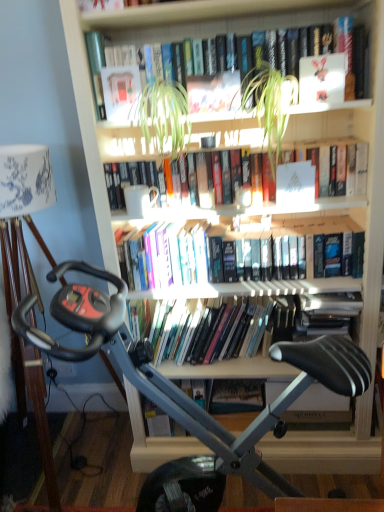
Question: Considering the positions of white matte paper at center, the 3th paperback book positioned from the left, and green leafy plant at center, positioned as the first plant in left-to-right order, in the image, is white matte paper at center, the 3th paperback book positioned from the left, wider or thinner than green leafy plant at center, positioned as the first plant in left-to-right order,?

Choices:
 (A) thin
 (B) wide

Answer: (A)

Question: From their relative heights in the image, would you say white matte paper at center, which is the third paperback book from back to front, is taller or shorter than green leafy plant at center, positioned as the first plant in left-to-right order?

Choices:
 (A) tall
 (B) short

Answer: (B)

Question: Which object is the farthest from the hardcover book at center, acting as the 1th book starting from the bottom?

Choices:
 (A) white matte book at upper center, acting as the fourth paperback book starting from the left
 (B) hardcover books at center, which is the 3th book from bottom to top
 (C) hardcover books at center, marked as the 3th book in a top-to-bottom arrangement
 (D) white matte paper at center, which is the 2th paperback book from front to back
 (E) hardcover book at upper center, which is counted as the first book, starting from the top

Answer: (E)

Question: Which object is the farthest from the hardcover books at center, which is the 3th book from bottom to top?

Choices:
 (A) hardcover books at center, marked as the 3th book in a top-to-bottom arrangement
 (B) silver metallic stationary bicycle at center
 (C) green leafy plant at upper center, arranged as the 1th plant when viewed from the right
 (D) hardcover book at center, acting as the 1th book starting from the bottom
 (E) green leafy plant at center, positioned as the first plant in left-to-right order

Answer: (B)